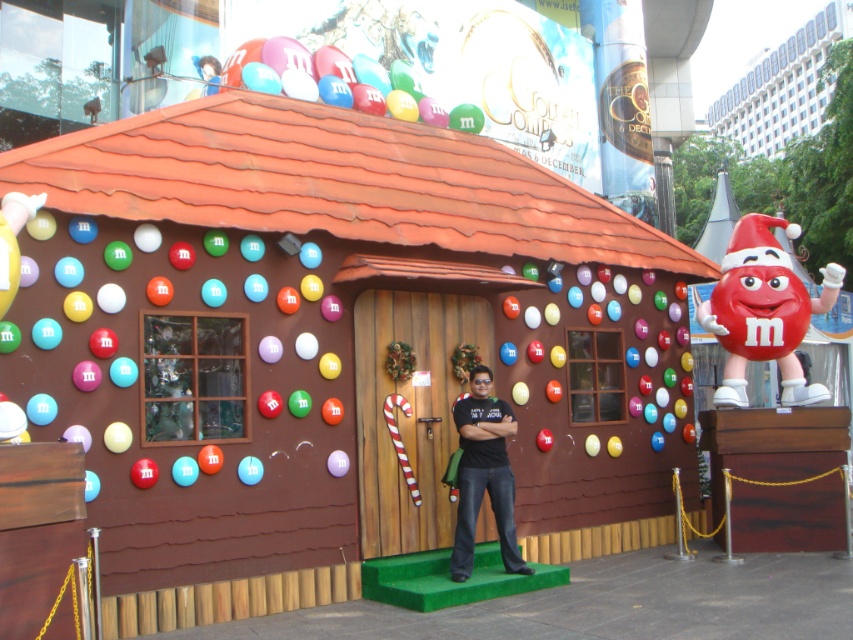
You are a child who wants to reach the smooth red candy at right and the shiny plastic balloon at upper center. Which object is easier to grab based on their sizes?

The smooth red candy at right has a smaller size compared to the shiny plastic balloon at upper center, so it is easier to grab.

You are a decorator trying to place a new decoration. You have a smooth red candy at right and a black matte shirt at center. Which object is wider?

The smooth red candy at right is wider than the black matte shirt at center.

You are standing in front of the candy house and want to place a new decoration at the point marked as point [763,310]. What type of decoration is already present at this location?

The point [763,310] corresponds to a smooth red candy at right.